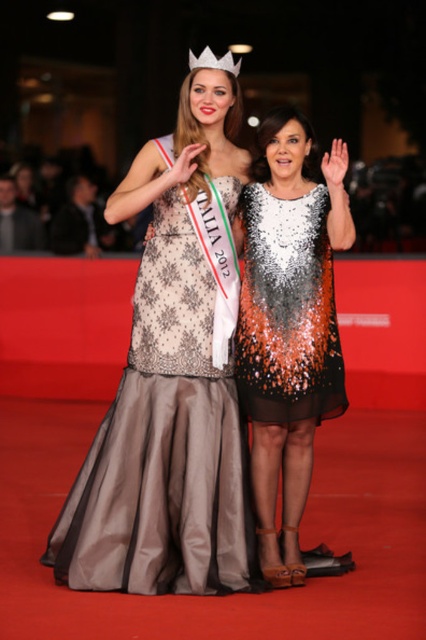
You are a photographer at the event and need to capture a closeup of the white plastic crown at upper center without the matte lace dress at center blocking it. Is this possible given their sizes?

The matte lace dress at center is taller than the white plastic crown at upper center, so it will block the crown. Adjust the angle to avoid the dress.

You are a photographer at a beauty pageant. You need to capture a closeup shot of the sparkly sequined dress at center and the white plastic crown at upper center. Which object should you focus on first if you want to ensure both are in focus?

The sparkly sequined dress at center is wider than the white plastic crown at upper center, so you should focus on the sparkly sequined dress at center first to ensure both are in focus.

You are a photographer at the event and need to position a spotlight exactly at point [167,428]. Which object from the scene will the spotlight illuminate?

The spotlight at point [167,428] will illuminate the matte lace dress at center.